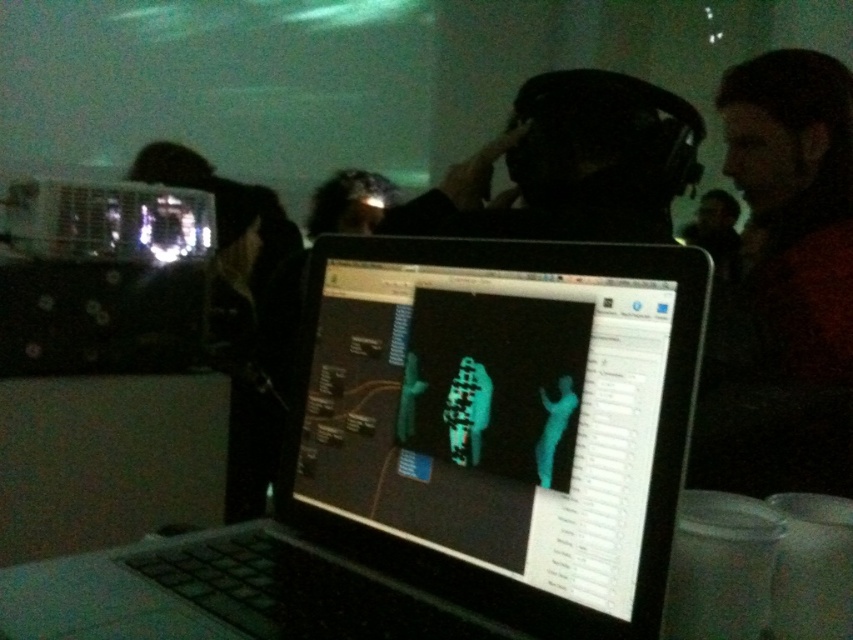
Question: Which object appears closest to the camera in this image?

Choices:
 (A) black matte headphones at center
 (B) black plastic laptop at center

Answer: (B)

Question: Does black plastic laptop at center appear under black matte headphones at center?

Choices:
 (A) yes
 (B) no

Answer: (A)

Question: Does black plastic laptop at center appear on the left side of black matte headphones at center?

Choices:
 (A) no
 (B) yes

Answer: (B)

Question: Which point is closer to the camera taking this photo?

Choices:
 (A) (265, 518)
 (B) (601, 90)

Answer: (A)

Question: Which object is farther from the camera taking this photo?

Choices:
 (A) black matte headphones at center
 (B) black plastic laptop at center

Answer: (A)

Question: Observing the image, what is the correct spatial positioning of black plastic laptop at center in reference to black matte headphones at center?

Choices:
 (A) left
 (B) right

Answer: (A)